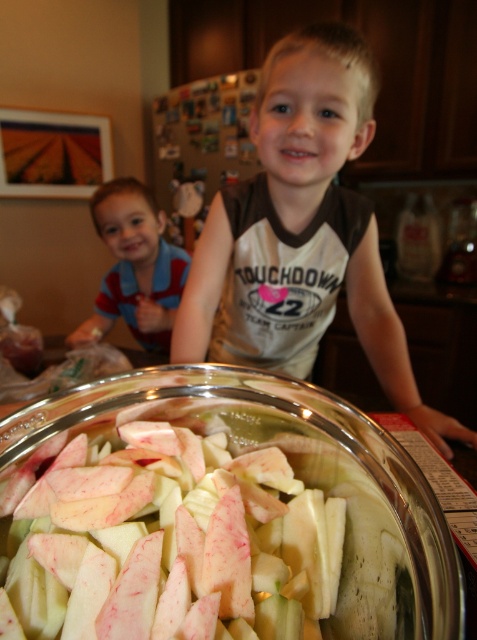
You are a photographer setting up a shoot in the kitchen. You need to place a light source to the right of the white cotton shirt at center and to the left of the striped shirt at left. Is this possible based on their positions?

The white cotton shirt at center is positioned on the right side of striped shirt at left, so placing a light source to the right of the white cotton shirt at center and to the left of the striped shirt at left is not possible because the white cotton shirt at center is already to the right of the striped shirt at left.

You are a parent trying to hand a snack to your children. You have a plate that is 12 inches wide. Can you place the plate between the white cotton shirt at center and the striped shirt at left so both children can reach it comfortably?

The distance between the white cotton shirt at center and the striped shirt at left is 36.20 inches. Since the plate is only 12 inches wide, there is enough space to place it between them comfortably.

You are a photographer trying to capture a clear photo of the white cotton shirt at center. The camera is currently positioned 25.11 inches away. Is this distance sufficient to ensure the shirt is in focus?

The white cotton shirt at center and camera are 25.11 inches apart from each other. This distance should be sufficient for the camera to focus on the white cotton shirt at center, assuming standard focusing capabilities.